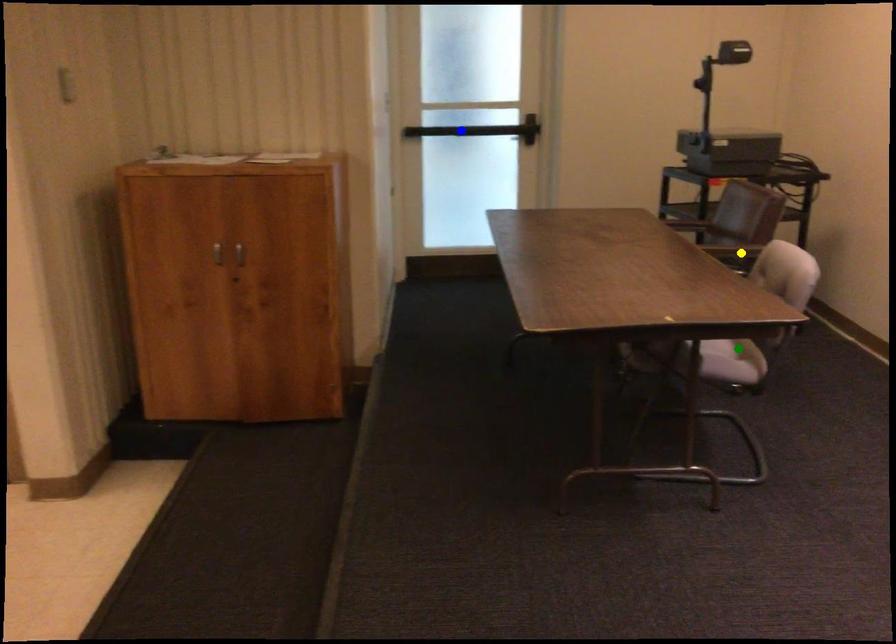
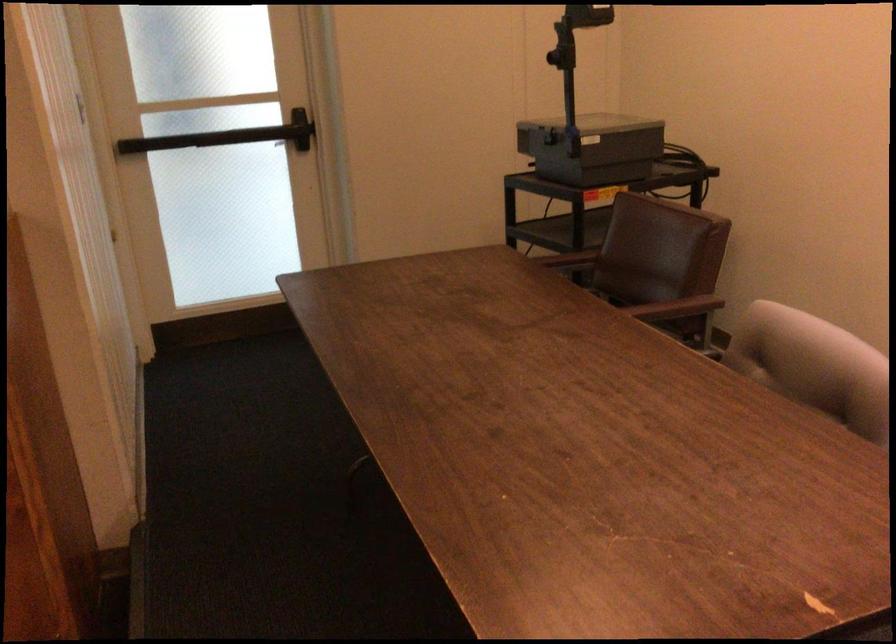
I am providing you with two images of the same scene from different viewpoints. Three points are marked in image1. Which point corresponds to a part or object that is occluded in image2?In image1, three points are marked. Which of them correspond to a part or object that is occluded in image2?Among the three points shown in image1, which one corresponds to a part or object that is no longer visible due to occlusion in image2?

green point cannot be seen in image2.